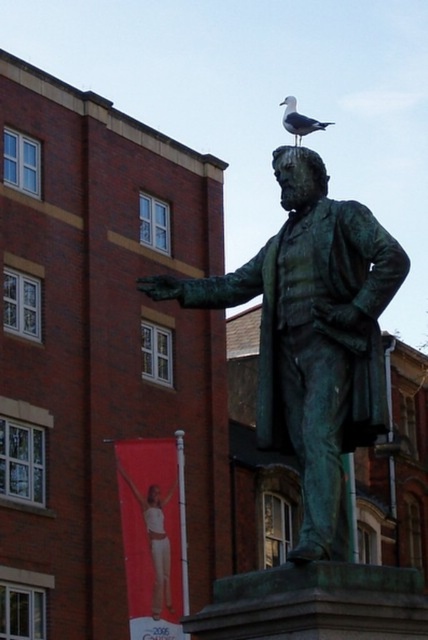
You are a birdwatcher trying to determine if the white feathered bird at statue top can comfortably land on the green patina statue at center without touching the edges. Based on their sizes, is this possible?

The green patina statue at center might be wider than white feathered bird at statue top, so there is a possibility that the bird can land comfortably without touching the edges, but the exact dimensions are uncertain.

You are a park visitor who wants to take a photo of the green patina statue at center and the white feathered bird at statue top. To ensure both are in frame, where should you position yourself relative to the statue?

You should position yourself in front of the green patina statue at center so that the white feathered bird at statue top is visible above it, as the green patina statue at center is located below the white feathered bird at statue top.

You are a birdwatcher trying to identify the white feathered bird at statue top. You notice that the green patina statue at center is smaller than the bird. Based on this observation, what can you infer about the actual size of the white feathered bird compared to the statue?

The white feathered bird at statue top is larger than the green patina statue at center because the statue is smaller than the bird.